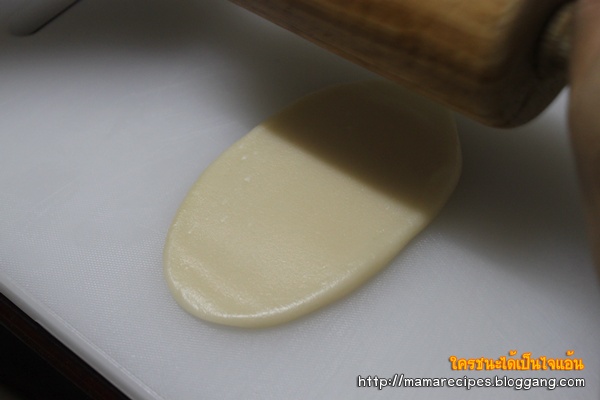
At what (x,y) coordinates should I click in order to perform the action: click on counter top to right of dough. Please return your answer as a coordinate pair (x, y). Image resolution: width=600 pixels, height=400 pixels. Looking at the image, I should click on (428, 303).